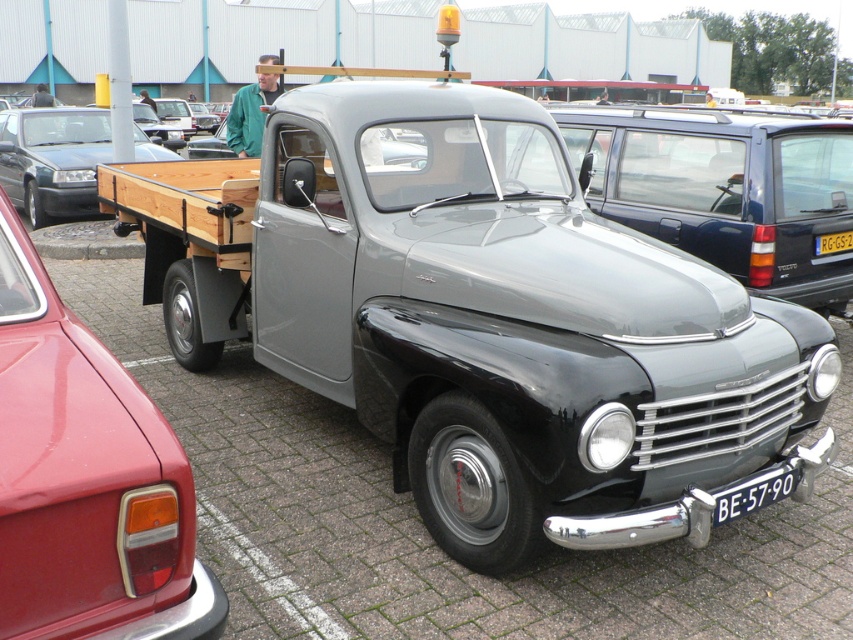
You are a photographer standing in front of the shiny black truck at center and the yellow plastic license plate at center. You want to take a picture of the truck but need to focus on the closest object first. Which object should you focus on first?

The shiny black truck at center is closer to the viewer than the yellow plastic license plate at center, so you should focus on the shiny black truck at center first.

You are standing at the center of the parking lot and see the vintage Volvo PV445 pickup truck and the metallic red car at lower left. Which vehicle is closer to you?

The metallic red car at lower left is closer to you because it is located at point (86,480), which is closer to the center than the Volvo PV445 pickup truck.